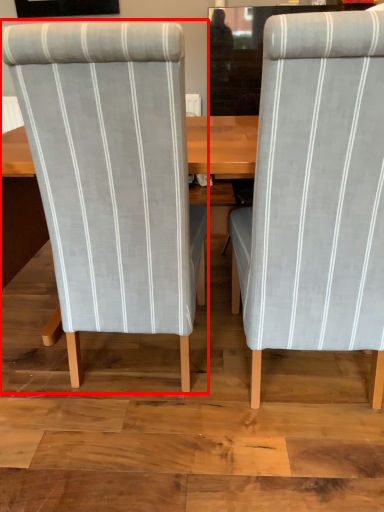
Question: Considering the relative positions of chair (annotated by the red box) and chair in the image provided, where is chair (annotated by the red box) located with respect to the staircase?

Choices:
 (A) left
 (B) right

Answer: (A)